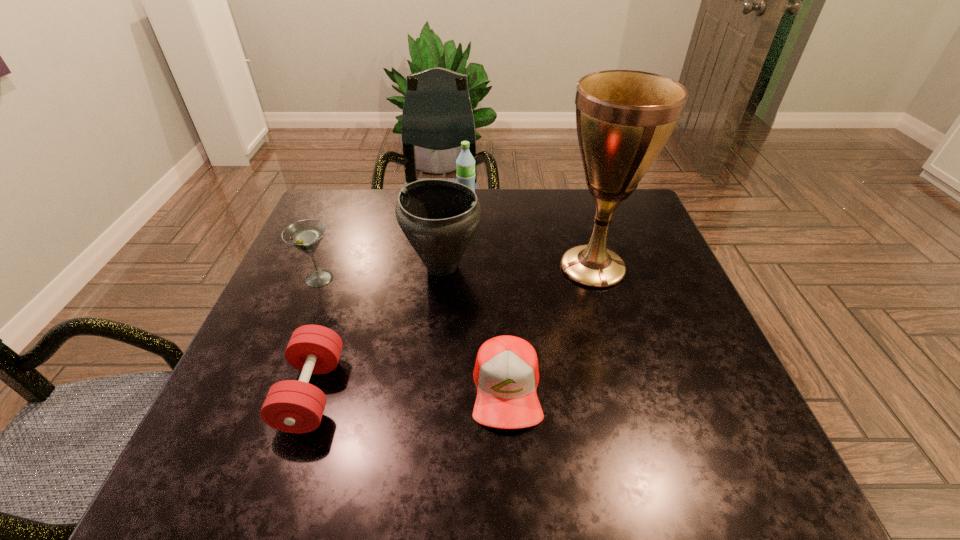
You are a GUI agent. You are given a task and a screenshot of the screen. Output one action in this format:
    pyautogui.click(x=<x>, y=<y>)
    Task: Click on the vacant space that's between the fifth tallest object and the shortest object
    
    Given the screenshot: What is the action you would take?
    pyautogui.click(x=409, y=390)

Locate an element on the screen. This screenshot has height=540, width=960. free space between the water bottle and the shortest object is located at coordinates (487, 296).

Find the location of `free space between the water bottle and the fifth tallest object`. free space between the water bottle and the fifth tallest object is located at coordinates (389, 298).

This screenshot has width=960, height=540. I want to click on free spot between the rightmost object and the urn, so click(x=517, y=267).

The image size is (960, 540). Identify the location of vacant area that lies between the urn and the baseball cap. (474, 328).

Choose which object is the fourth nearest neighbor to the fifth tallest object. Please provide its 2D coordinates. Your answer should be formatted as a tuple, i.e. [(x, y)], where the tuple contains the x and y coordinates of a point satisfying the conditions above.

[(624, 118)]

Where is `the second closest object to the rightmost object`? the second closest object to the rightmost object is located at coordinates (438, 217).

Identify the location of free space that satisfies the following two spatial constraints: 1. on the back side of the water bottle; 2. on the left side of the fourth tallest object. (349, 204).

Find the location of `vacant space that satisfies the following two spatial constraints: 1. on the back side of the fourth tallest object; 2. on the right side of the urn`. vacant space that satisfies the following two spatial constraints: 1. on the back side of the fourth tallest object; 2. on the right side of the urn is located at coordinates (324, 266).